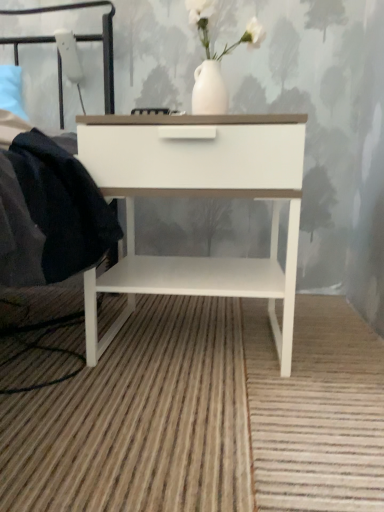
The image size is (384, 512). Identify the location of vacant space in front of white glossy nightstand at center. (190, 423).